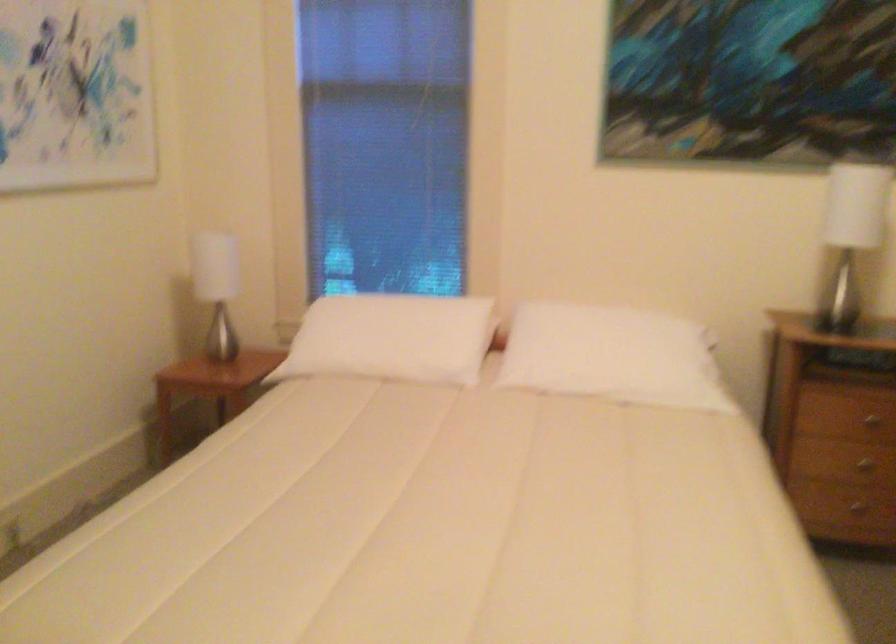
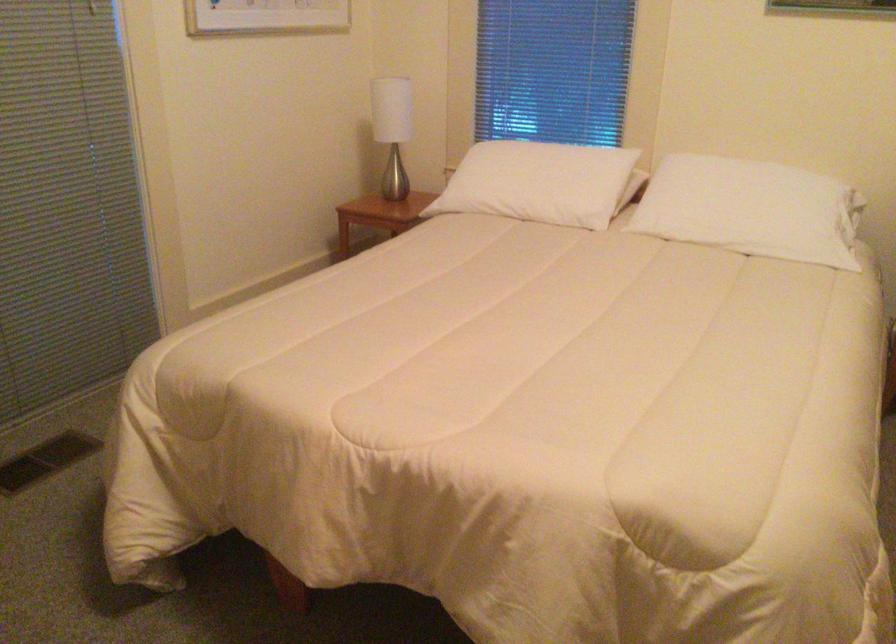
The point at (401, 346) is marked in the first image. Where is the corresponding point in the second image?

(538, 183)